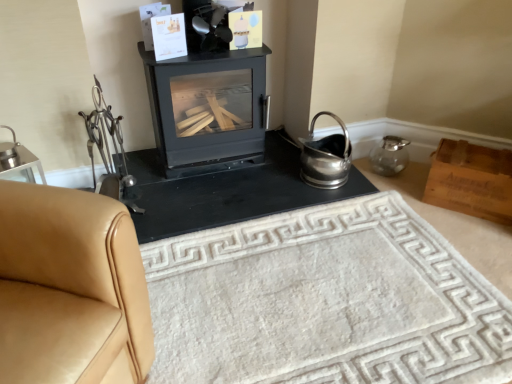
Question: Looking at the image, does black matte wood burning stove at center seem bigger or smaller compared to wooden box at right?

Choices:
 (A) big
 (B) small

Answer: (A)

Question: Looking at their shapes, would you say black matte wood burning stove at center is wider or thinner than wooden box at right?

Choices:
 (A) thin
 (B) wide

Answer: (B)

Question: Estimate the real-world distances between objects in this image. Which object is closer to the wooden box at right?

Choices:
 (A) black matte fireplace at center
 (B) white textured rug at center
 (C) black matte wood burning stove at center
 (D) tan leather couch at left

Answer: (A)

Question: Based on their relative distances, which object is farther from the white textured rug at center?

Choices:
 (A) black matte fireplace at center
 (B) wooden box at right
 (C) black matte wood burning stove at center
 (D) tan leather couch at left

Answer: (C)